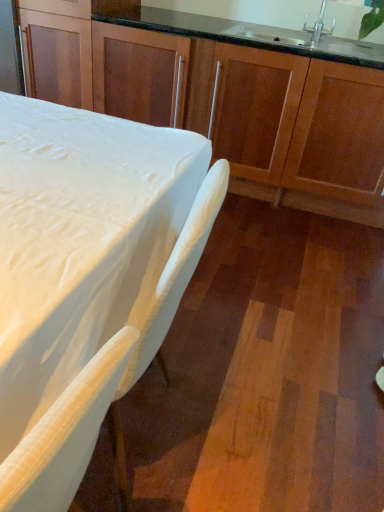
Question: From the image's perspective, does wooden cabinets at center appear lower than white matte table at lower left?

Choices:
 (A) no
 (B) yes

Answer: (A)

Question: Does wooden cabinets at center appear on the right side of white matte table at lower left?

Choices:
 (A) no
 (B) yes

Answer: (B)

Question: Can you confirm if wooden cabinets at center is smaller than white matte table at lower left?

Choices:
 (A) yes
 (B) no

Answer: (B)

Question: Is wooden cabinets at center surrounding white matte table at lower left?

Choices:
 (A) no
 (B) yes

Answer: (A)

Question: Is wooden cabinets at center at the left side of white matte table at lower left?

Choices:
 (A) yes
 (B) no

Answer: (B)

Question: From a real-world perspective, is wooden cabinets at center below white matte table at lower left?

Choices:
 (A) yes
 (B) no

Answer: (B)

Question: Is silver metallic faucet at upper right located outside white matte table at lower left?

Choices:
 (A) yes
 (B) no

Answer: (A)

Question: Does silver metallic faucet at upper right appear on the right side of white matte table at lower left?

Choices:
 (A) yes
 (B) no

Answer: (A)

Question: From a real-world perspective, is silver metallic faucet at upper right on white matte table at lower left?

Choices:
 (A) no
 (B) yes

Answer: (B)

Question: Is the position of silver metallic faucet at upper right more distant than that of white matte table at lower left?

Choices:
 (A) yes
 (B) no

Answer: (A)

Question: Considering the relative sizes of silver metallic faucet at upper right and white matte table at lower left in the image provided, is silver metallic faucet at upper right bigger than white matte table at lower left?

Choices:
 (A) yes
 (B) no

Answer: (B)

Question: Can you confirm if silver metallic faucet at upper right is smaller than white matte table at lower left?

Choices:
 (A) no
 (B) yes

Answer: (B)

Question: From the image's perspective, is white matte table at lower left under silver metallic faucet at upper right?

Choices:
 (A) no
 (B) yes

Answer: (B)